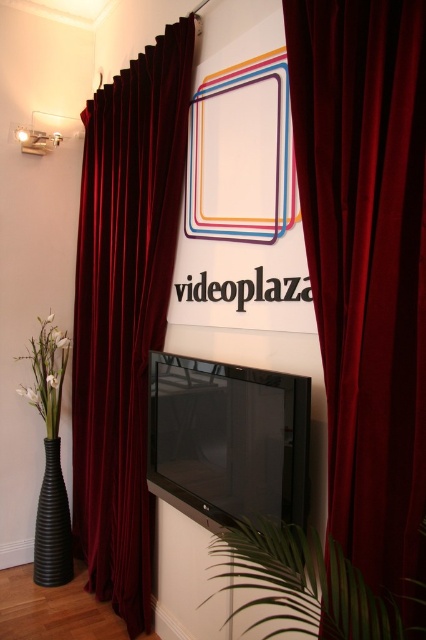
You are an interior designer assessing the room layout. You need to place a new piece of furniture that requires the space between the black glossy flat screen tv at center and the white matte vase at lower left to be at least 2 meters wide. Can you confirm if the space between them is sufficient?

The black glossy flat screen tv at center is wider than the white matte vase at lower left, but the description does not provide specific measurements of the distance between them. Therefore, it is impossible to determine if the space between them is at least 2 meters wide based on the given information.

In the scene shown: You are standing in front of the TV and want to adjust the curtains. Which curtain, the velvet dark red curtain at center or the velvet dark red curtain at left, is closer to your right hand if you are facing the TV?

The velvet dark red curtain at center is positioned on the right side of the velvet dark red curtain at left, so if you are facing the TV, the velvet dark red curtain at center is closer to your right hand.